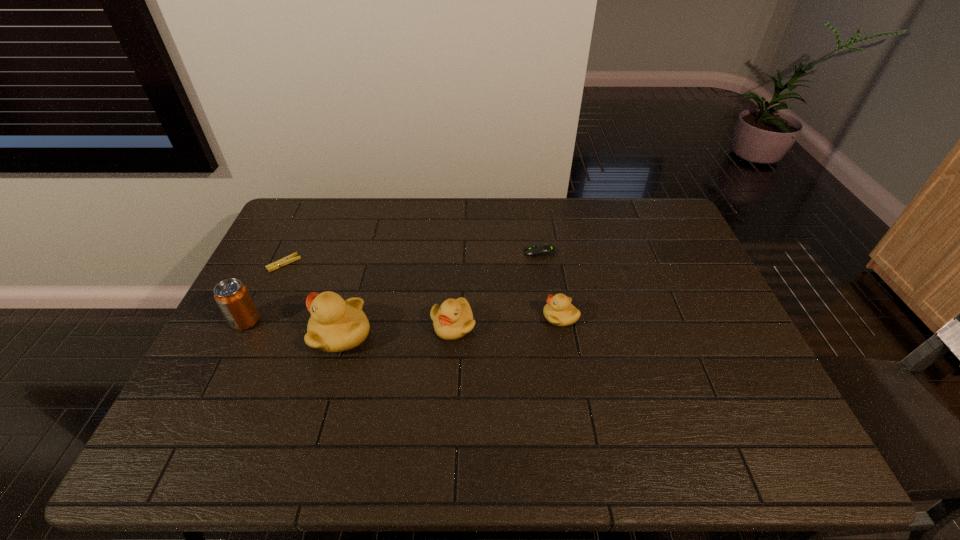
Where is `free spot between the rightmost duckling and the clothespin`? Image resolution: width=960 pixels, height=540 pixels. free spot between the rightmost duckling and the clothespin is located at coordinates (422, 290).

In order to click on vacant space that's between the tallest duckling and the fourth object from left to right in this screenshot , I will do `click(397, 329)`.

Where is `unoccupied position between the soda can and the tallest duckling`? Image resolution: width=960 pixels, height=540 pixels. unoccupied position between the soda can and the tallest duckling is located at coordinates tap(294, 327).

Where is `vacant space in between the third tallest object and the shortest duckling`? The width and height of the screenshot is (960, 540). vacant space in between the third tallest object and the shortest duckling is located at coordinates (507, 321).

I want to click on vacant space that is in between the shortest object and the second tallest duckling, so click(x=369, y=294).

Locate an element on the screen. vacant area that lies between the fifth tallest object and the soda can is located at coordinates pos(393,287).

I want to click on vacant region between the clothespin and the soda can, so click(x=265, y=292).

Image resolution: width=960 pixels, height=540 pixels. What are the coordinates of `object that stands as the third closest to the soda can` in the screenshot? It's located at (452, 320).

Locate an element on the screen. object that is the closest to the tallest duckling is located at coordinates (232, 297).

Identify the location of the third closest duckling to the shortest object. The width and height of the screenshot is (960, 540). (559, 311).